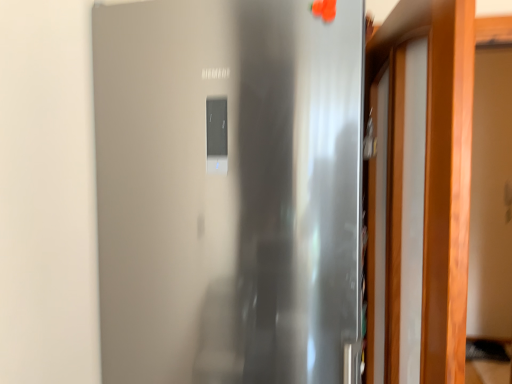
Describe the element at coordinates (430, 177) in the screenshot. I see `wooden door at right, the first door when ordered from right to left` at that location.

Identify the location of wooden door at right, positioned as the second door in left-to-right order. (430, 177).

At what (x,y) coordinates should I click in order to perform the action: click on stainless steel refrigerator at center, which ranks as the second door in right-to-left order. Please return your answer as a coordinate pair (x, y). The image size is (512, 384). Looking at the image, I should click on (229, 191).

The height and width of the screenshot is (384, 512). What do you see at coordinates (229, 191) in the screenshot?
I see `stainless steel refrigerator at center, which ranks as the second door in right-to-left order` at bounding box center [229, 191].

How much space does stainless steel refrigerator at center, which ranks as the second door in right-to-left order, occupy horizontally?

stainless steel refrigerator at center, which ranks as the second door in right-to-left order, is 22.65 inches in width.

Where is `wooden door at right, positioned as the second door in left-to-right order`? The image size is (512, 384). wooden door at right, positioned as the second door in left-to-right order is located at coordinates (430, 177).

Visually, is wooden door at right, positioned as the second door in left-to-right order, positioned to the left or to the right of stainless steel refrigerator at center, which ranks as the second door in right-to-left order?

Based on their positions, wooden door at right, positioned as the second door in left-to-right order, is located to the right of stainless steel refrigerator at center, which ranks as the second door in right-to-left order.

Which is behind, wooden door at right, the first door when ordered from right to left, or stainless steel refrigerator at center, arranged as the 1th door when viewed from the left?

Positioned behind is stainless steel refrigerator at center, arranged as the 1th door when viewed from the left.

Between point (439, 322) and point (161, 330), which one is positioned behind?

Point (161, 330)

From the image's perspective, which object appears higher, wooden door at right, positioned as the second door in left-to-right order, or stainless steel refrigerator at center, which ranks as the second door in right-to-left order?

wooden door at right, positioned as the second door in left-to-right order.

From a real-world perspective, which is physically below, wooden door at right, positioned as the second door in left-to-right order, or stainless steel refrigerator at center, which ranks as the second door in right-to-left order?

stainless steel refrigerator at center, which ranks as the second door in right-to-left order.

Which object is wider, wooden door at right, the first door when ordered from right to left, or stainless steel refrigerator at center, arranged as the 1th door when viewed from the left?

With larger width is stainless steel refrigerator at center, arranged as the 1th door when viewed from the left.

Considering the relative sizes of wooden door at right, positioned as the second door in left-to-right order, and stainless steel refrigerator at center, which ranks as the second door in right-to-left order, in the image provided, is wooden door at right, positioned as the second door in left-to-right order, shorter than stainless steel refrigerator at center, which ranks as the second door in right-to-left order,?

Indeed, wooden door at right, positioned as the second door in left-to-right order, has a lesser height compared to stainless steel refrigerator at center, which ranks as the second door in right-to-left order.

Which of these two, wooden door at right, the first door when ordered from right to left, or stainless steel refrigerator at center, arranged as the 1th door when viewed from the left, is bigger?

stainless steel refrigerator at center, arranged as the 1th door when viewed from the left.

Is stainless steel refrigerator at center, arranged as the 1th door when viewed from the left, surrounded by wooden door at right, positioned as the second door in left-to-right order?

That's incorrect, stainless steel refrigerator at center, arranged as the 1th door when viewed from the left, is not inside wooden door at right, positioned as the second door in left-to-right order.

Looking at this image, would you consider wooden door at right, the first door when ordered from right to left, to be distant from stainless steel refrigerator at center, arranged as the 1th door when viewed from the left?

No, wooden door at right, the first door when ordered from right to left, is not far away from stainless steel refrigerator at center, arranged as the 1th door when viewed from the left.

Could you tell me if wooden door at right, the first door when ordered from right to left, is turned towards stainless steel refrigerator at center, arranged as the 1th door when viewed from the left?

Yes.

How many degrees apart are the facing directions of wooden door at right, the first door when ordered from right to left, and stainless steel refrigerator at center, arranged as the 1th door when viewed from the left?

The facing directions of wooden door at right, the first door when ordered from right to left, and stainless steel refrigerator at center, arranged as the 1th door when viewed from the left, are 103 degrees apart.

Measure the distance between wooden door at right, positioned as the second door in left-to-right order, and stainless steel refrigerator at center, which ranks as the second door in right-to-left order.

wooden door at right, positioned as the second door in left-to-right order, and stainless steel refrigerator at center, which ranks as the second door in right-to-left order, are 16.79 inches apart from each other.

Where is `door that appears behind the wooden door at right, the first door when ordered from right to left`? door that appears behind the wooden door at right, the first door when ordered from right to left is located at coordinates (229, 191).

Is stainless steel refrigerator at center, arranged as the 1th door when viewed from the left, to the left or to the right of wooden door at right, the first door when ordered from right to left, in the image?

Clearly, stainless steel refrigerator at center, arranged as the 1th door when viewed from the left, is on the left of wooden door at right, the first door when ordered from right to left, in the image.

Is stainless steel refrigerator at center, arranged as the 1th door when viewed from the left, positioned before wooden door at right, the first door when ordered from right to left?

No, the depth of stainless steel refrigerator at center, arranged as the 1th door when viewed from the left, is greater than that of wooden door at right, the first door when ordered from right to left.

Does point (273, 344) appear closer or farther from the camera than point (465, 230)?

Point (273, 344) appears to be farther away from the viewer than point (465, 230).

From the picture: From the image's perspective, is stainless steel refrigerator at center, arranged as the 1th door when viewed from the left, located above or below wooden door at right, positioned as the second door in left-to-right order?

Based on their image positions, stainless steel refrigerator at center, arranged as the 1th door when viewed from the left, is located beneath wooden door at right, positioned as the second door in left-to-right order.

From a real-world perspective, is stainless steel refrigerator at center, arranged as the 1th door when viewed from the left, on top of wooden door at right, positioned as the second door in left-to-right order?

No, from a real-world perspective, stainless steel refrigerator at center, arranged as the 1th door when viewed from the left, is not on top of wooden door at right, positioned as the second door in left-to-right order.

Considering the sizes of objects stainless steel refrigerator at center, arranged as the 1th door when viewed from the left, and wooden door at right, the first door when ordered from right to left, in the image provided, who is wider, stainless steel refrigerator at center, arranged as the 1th door when viewed from the left, or wooden door at right, the first door when ordered from right to left,?

Wider between the two is stainless steel refrigerator at center, arranged as the 1th door when viewed from the left.

Which of these two, stainless steel refrigerator at center, arranged as the 1th door when viewed from the left, or wooden door at right, positioned as the second door in left-to-right order, stands shorter?

wooden door at right, positioned as the second door in left-to-right order, is shorter.

Who is smaller, stainless steel refrigerator at center, which ranks as the second door in right-to-left order, or wooden door at right, the first door when ordered from right to left?

With smaller size is wooden door at right, the first door when ordered from right to left.

Would you say stainless steel refrigerator at center, arranged as the 1th door when viewed from the left, contains wooden door at right, positioned as the second door in left-to-right order?

No, wooden door at right, positioned as the second door in left-to-right order, is located outside of stainless steel refrigerator at center, arranged as the 1th door when viewed from the left.

Is there a large distance between stainless steel refrigerator at center, which ranks as the second door in right-to-left order, and wooden door at right, positioned as the second door in left-to-right order?

No, there isn't a large distance between stainless steel refrigerator at center, which ranks as the second door in right-to-left order, and wooden door at right, positioned as the second door in left-to-right order.

Is stainless steel refrigerator at center, which ranks as the second door in right-to-left order, turned away from wooden door at right, the first door when ordered from right to left?

That's not correct — stainless steel refrigerator at center, which ranks as the second door in right-to-left order, is not looking away from wooden door at right, the first door when ordered from right to left.

Measure the distance from stainless steel refrigerator at center, arranged as the 1th door when viewed from the left, to wooden door at right, positioned as the second door in left-to-right order.

The distance of stainless steel refrigerator at center, arranged as the 1th door when viewed from the left, from wooden door at right, positioned as the second door in left-to-right order, is 16.79 inches.

At what (x,y) coordinates should I click in order to perform the action: click on door on the right of stainless steel refrigerator at center, which ranks as the second door in right-to-left order. Please return your answer as a coordinate pair (x, y). The height and width of the screenshot is (384, 512). Looking at the image, I should click on (430, 177).

Where is `door below the wooden door at right, positioned as the second door in left-to-right order (from a real-world perspective)`? Image resolution: width=512 pixels, height=384 pixels. door below the wooden door at right, positioned as the second door in left-to-right order (from a real-world perspective) is located at coordinates (229, 191).

The width and height of the screenshot is (512, 384). Identify the location of door on the left of wooden door at right, positioned as the second door in left-to-right order. (229, 191).